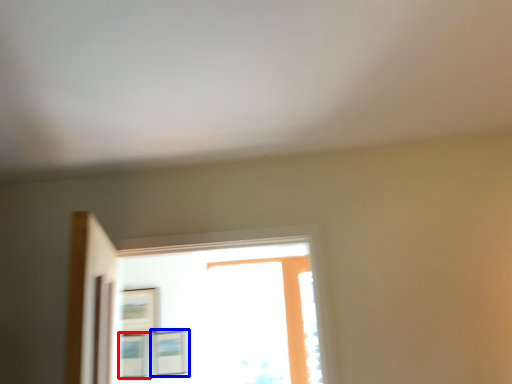
Question: Which object is further to the camera taking this photo, picture frame (highlighted by a red box) or picture frame (highlighted by a blue box)?

Choices:
 (A) picture frame
 (B) picture frame

Answer: (A)